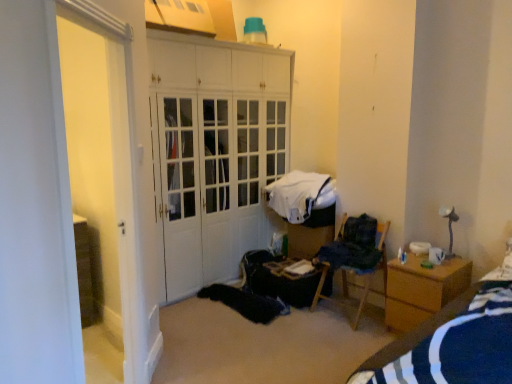
Question: From the image's perspective, relative to dark blue fabric at right, positioned as the 1th clothing in front-to-back order, is wooden table at center above or below?

Choices:
 (A) below
 (B) above

Answer: (A)

Question: Is point tap(287, 278) closer or farther from the camera than point tap(356, 246)?

Choices:
 (A) closer
 (B) farther

Answer: (B)

Question: Estimate the real-world distances between objects in this image. Which object is farther from the white glossy door at left?

Choices:
 (A) white glossy cabinet at center
 (B) white fabric at center, the first clothing from the back
 (C) wooden chair at center
 (D) wooden table at center
 (E) dark blue fabric at right, the second clothing from the back

Answer: (C)

Question: Estimate the real-world distances between objects in this image. Which object is farther from the dark blue fabric at right, the second clothing from the back?

Choices:
 (A) wooden table at center
 (B) wooden chair at center
 (C) white fabric at center, the first clothing from the back
 (D) wooden nightstand at right
 (E) blue striped fabric at lower right

Answer: (E)